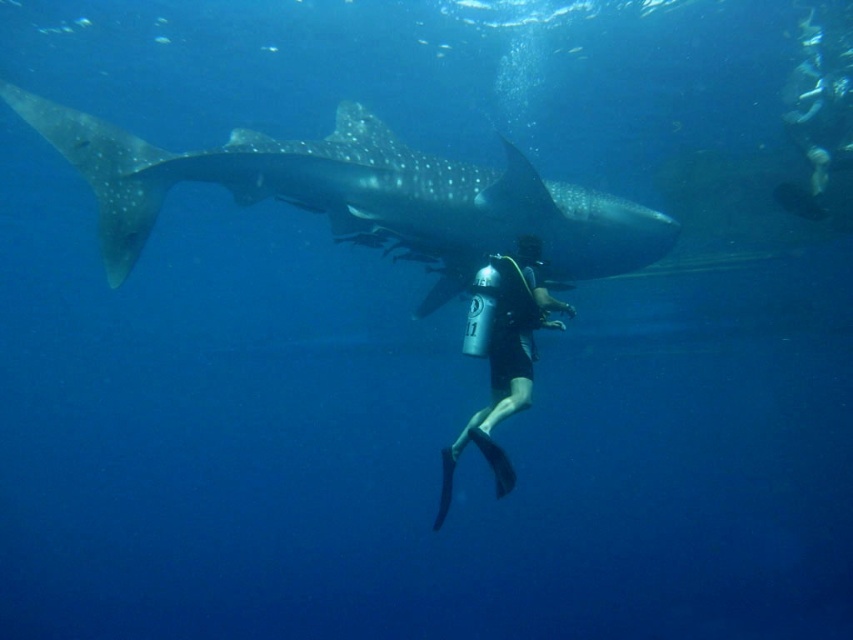
Measure the distance between speckled gray whale shark at upper center and black matte scuba diver at center.

A distance of 5.95 feet exists between speckled gray whale shark at upper center and black matte scuba diver at center.

Is point (300, 144) positioned in front of point (546, 326)?

No.

You are a GUI agent. You are given a task and a screenshot of the screen. Output one action in this format:
    pyautogui.click(x=<x>, y=<y>)
    Task: Click on the speckled gray whale shark at upper center
    The image size is (853, 640).
    Given the screenshot: What is the action you would take?
    click(357, 193)